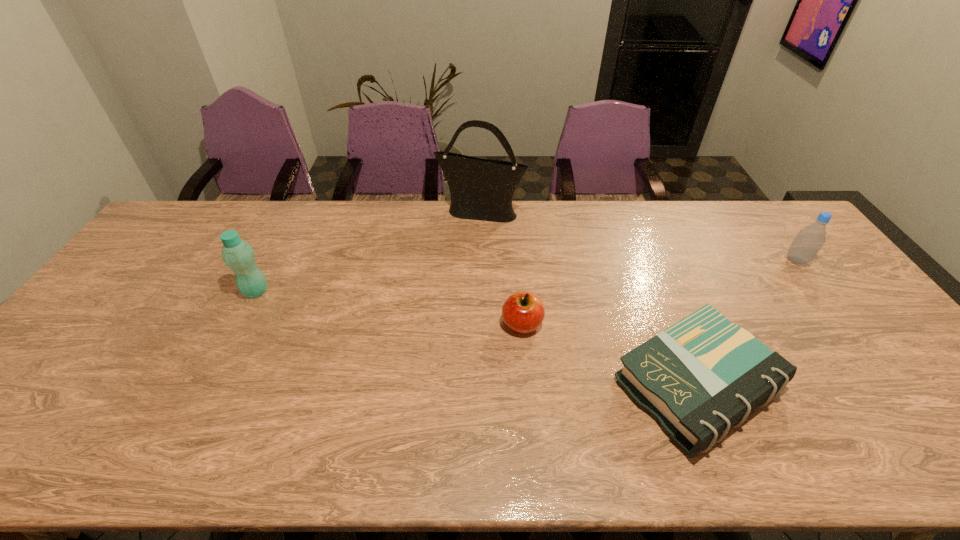
Where is `free spot between the shoulder bag and the apple`? free spot between the shoulder bag and the apple is located at coordinates (501, 268).

Locate an element on the screen. object that is the second closest to the leftmost object is located at coordinates (523, 312).

The width and height of the screenshot is (960, 540). I want to click on the fourth closest object to the farther bottle, so click(237, 254).

I want to click on free space that satisfies the following two spatial constraints: 1. on the front side of the apple; 2. on the right side of the farthest object, so click(480, 325).

You are a GUI agent. You are given a task and a screenshot of the screen. Output one action in this format:
    pyautogui.click(x=<x>, y=<y>)
    Task: Click on the free spot that satisfies the following two spatial constraints: 1. on the front side of the tallest object; 2. on the left side of the shorter bottle
    Image resolution: width=960 pixels, height=540 pixels.
    Given the screenshot: What is the action you would take?
    pyautogui.click(x=480, y=260)